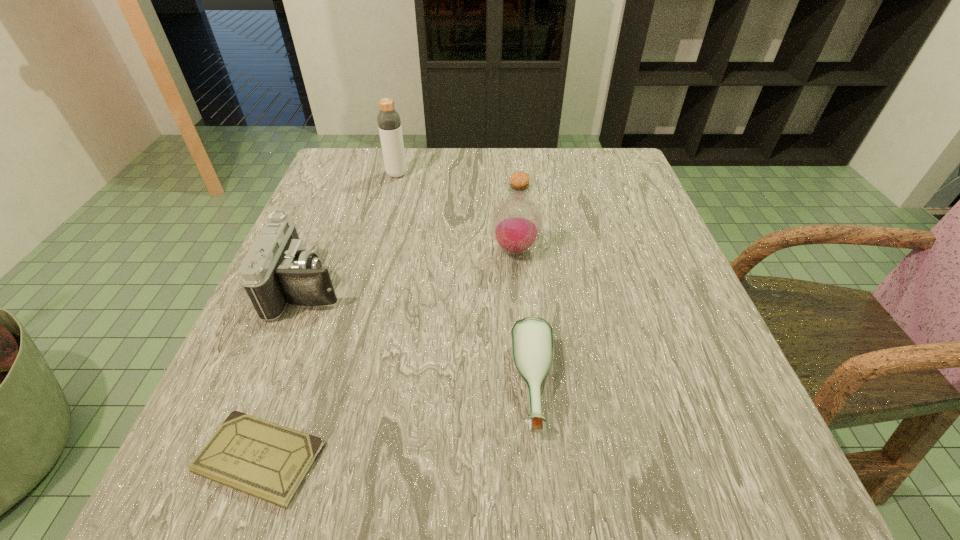
I want to click on free point between the checkbook and the shortest bottle, so click(396, 422).

Find the location of `empty location between the farthest bottle and the camera`. empty location between the farthest bottle and the camera is located at coordinates (352, 231).

Where is `free spot between the second farthest bottle and the shortest object`? free spot between the second farthest bottle and the shortest object is located at coordinates (387, 354).

This screenshot has height=540, width=960. I want to click on vacant space that is in between the leftmost bottle and the second nearest bottle, so click(x=456, y=212).

This screenshot has height=540, width=960. I want to click on empty location between the fourth tallest object and the farthest object, so click(465, 280).

Find the location of a particular element. The image size is (960, 540). object that is the third closest to the checkbook is located at coordinates (516, 225).

This screenshot has width=960, height=540. What are the coordinates of `object that is the fourth closest one to the second nearest bottle` in the screenshot? It's located at (268, 461).

Point out which bottle is positioned as the second nearest to the leftmost bottle. Please provide its 2D coordinates. Your answer should be formatted as a tuple, i.e. [(x, y)], where the tuple contains the x and y coordinates of a point satisfying the conditions above.

[(531, 338)]

Where is `bottle identified as the second closest to the farthest bottle`? bottle identified as the second closest to the farthest bottle is located at coordinates (531, 338).

Image resolution: width=960 pixels, height=540 pixels. In order to click on vacant region that satisfies the following two spatial constraints: 1. on the back side of the shortest object; 2. on the left side of the second nearest bottle in this screenshot , I will do `click(335, 250)`.